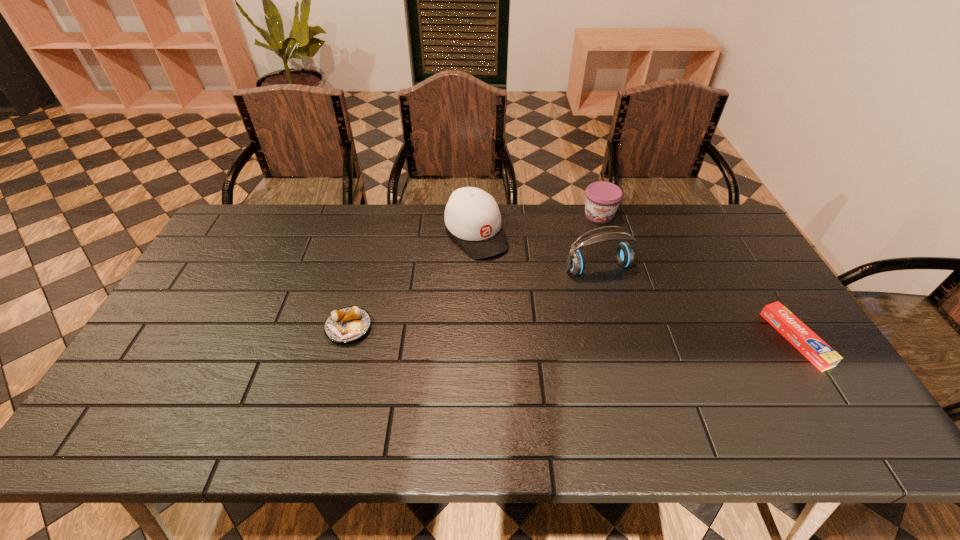
Find the location of `the leftmost object`. the leftmost object is located at coordinates (348, 324).

Locate an element on the screen. This screenshot has height=540, width=960. pastry is located at coordinates (348, 324).

Identify the location of the rightmost object. (819, 353).

I want to click on toothpaste, so 819,353.

Where is `headset`? headset is located at coordinates (624, 253).

Locate an element on the screen. the third shortest object is located at coordinates (602, 199).

At what (x,y) coordinates should I click in order to perform the action: click on the second object from left to right. Please return your answer as a coordinate pair (x, y). The image size is (960, 540). Looking at the image, I should click on (472, 215).

In order to click on free space located on the front of the fourth tallest object in this screenshot , I will do `click(332, 390)`.

Where is `vacant space located on the back of the shortest object`? The width and height of the screenshot is (960, 540). vacant space located on the back of the shortest object is located at coordinates (725, 226).

Where is `vacant space situated on the ear cups of the headset`? The width and height of the screenshot is (960, 540). vacant space situated on the ear cups of the headset is located at coordinates (653, 355).